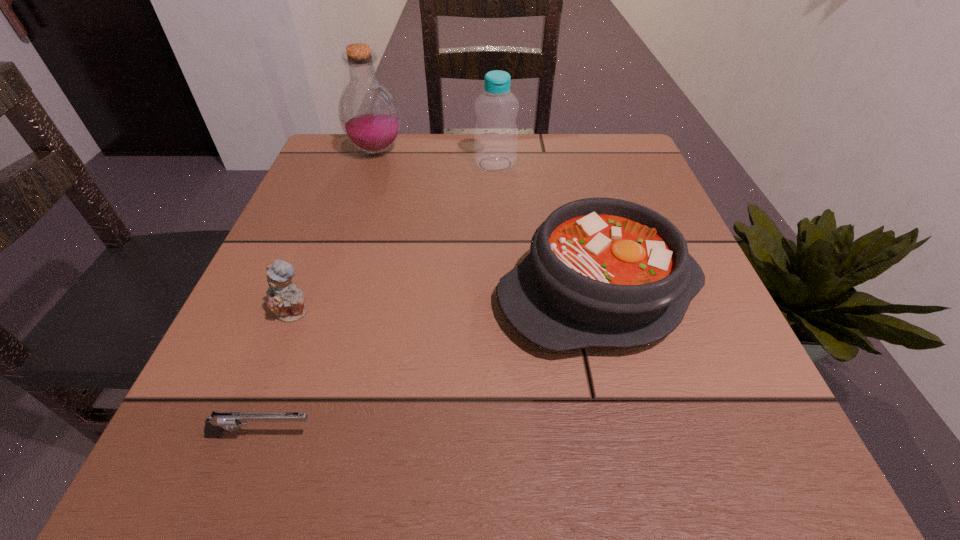
You are a GUI agent. You are given a task and a screenshot of the screen. Output one action in this format:
    pyautogui.click(x=<x>, y=<y>)
    Task: Click on the vacant point located 0.180m on the front-facing side of the fourth tallest object
    
    Given the screenshot: What is the action you would take?
    pyautogui.click(x=247, y=438)

The width and height of the screenshot is (960, 540). Find the location of `free space located 0.260m on the front-facing side of the shortest object`. free space located 0.260m on the front-facing side of the shortest object is located at coordinates (526, 435).

The image size is (960, 540). I want to click on object positioned at the near edge, so click(219, 421).

This screenshot has width=960, height=540. I want to click on bottle situated at the left edge, so click(x=369, y=115).

Where is `teddy bear at the left edge`? The width and height of the screenshot is (960, 540). teddy bear at the left edge is located at coordinates (286, 300).

You are a GUI agent. You are given a task and a screenshot of the screen. Output one action in this format:
    pyautogui.click(x=<x>, y=<y>)
    Task: Click on the pistol that is at the left edge
    This screenshot has height=540, width=960.
    Given the screenshot: What is the action you would take?
    pyautogui.click(x=219, y=421)

Locate an element on the screen. object present at the right edge is located at coordinates (602, 272).

The height and width of the screenshot is (540, 960). Identify the location of object positioned at the far left corner. 369,115.

Locate an element on the screen. The width and height of the screenshot is (960, 540). object that is at the near left corner is located at coordinates (219, 421).

At what (x,y) coordinates should I click in order to perform the action: click on free point at the near edge. Please return your answer as a coordinate pair (x, y). The image size is (960, 540). Looking at the image, I should click on (389, 456).